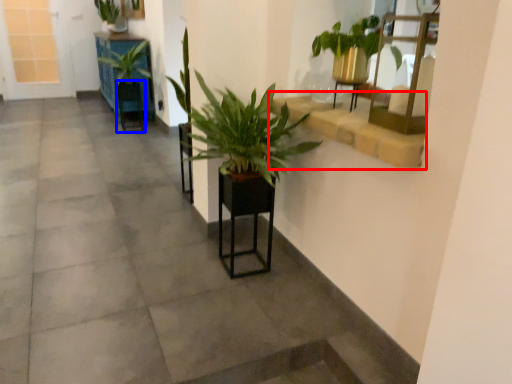
Question: Which point is closer to the camera, window sill (highlighted by a red box) or armchair (highlighted by a blue box)?

Choices:
 (A) window sill
 (B) armchair

Answer: (A)